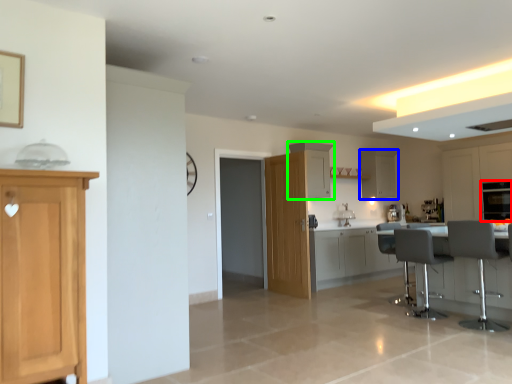
Question: Which object is the farthest from oven (highlighted by a red box)? Choose among these: cabinetry (highlighted by a blue box) or cabinetry (highlighted by a green box).

Choices:
 (A) cabinetry
 (B) cabinetry

Answer: (B)